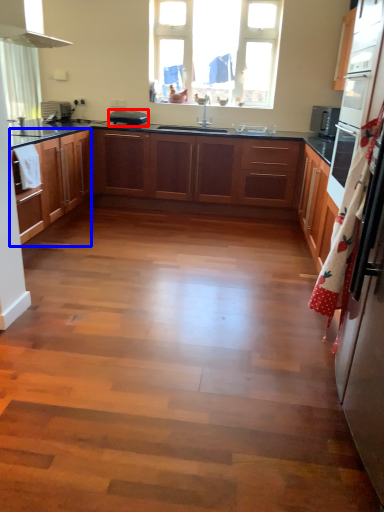
Question: Among these objects, which one is farthest to the camera, appliance (highlighted by a red box) or cabinetry (highlighted by a blue box)?

Choices:
 (A) appliance
 (B) cabinetry

Answer: (A)